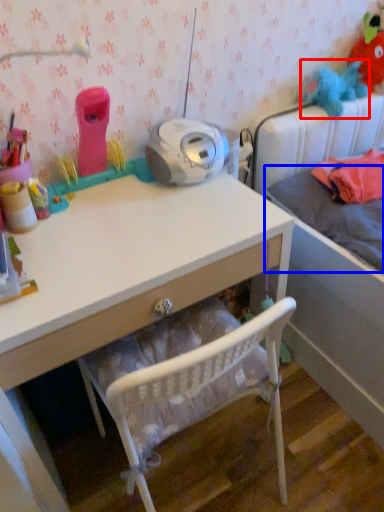
Question: Which object appears closest to the camera in this image, toy (highlighted by a red box) or mattress (highlighted by a blue box)?

Choices:
 (A) toy
 (B) mattress

Answer: (B)